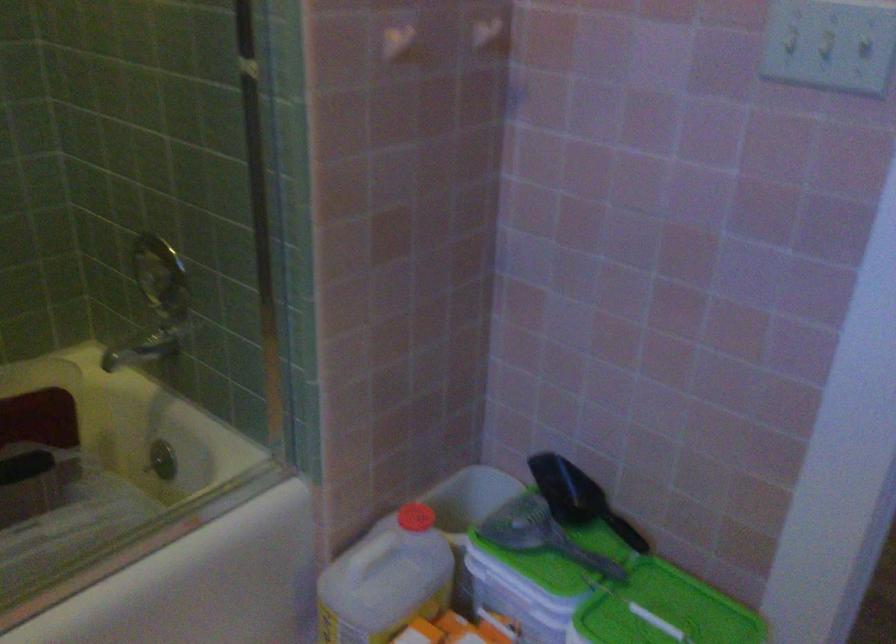
Describe the element at coordinates (159, 279) in the screenshot. I see `the shower faucet handle` at that location.